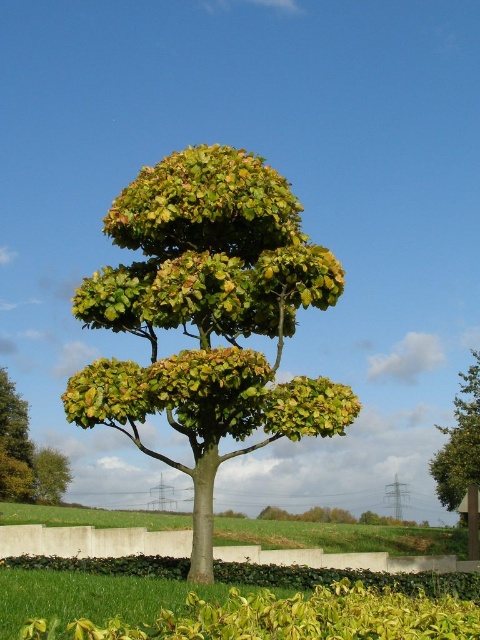
You are standing in the field looking at the green leafy tree at center and the green leafy hedge at lower center. Which object is closer to you?

The green leafy hedge at lower center is closer to you because the green leafy tree at center is positioned over it, indicating it is further away.

You are standing in the grassy field looking at the tree. There are two points marked on the image. The first point is at coordinates point [225,244] and the second is at point [399,579]. Which point is closer to you?

Point [225,244] is further to the viewer than point [399,579], so the first point is closer to you.

You are standing in the field looking at the tree. Which area of grass, the green leafy grass at center or the green grass at lower center, has a larger coverage area?

The green grass at lower center has a larger coverage area than the green leafy grass at center because the green leafy grass at center occupies less space than green grass at lower center.